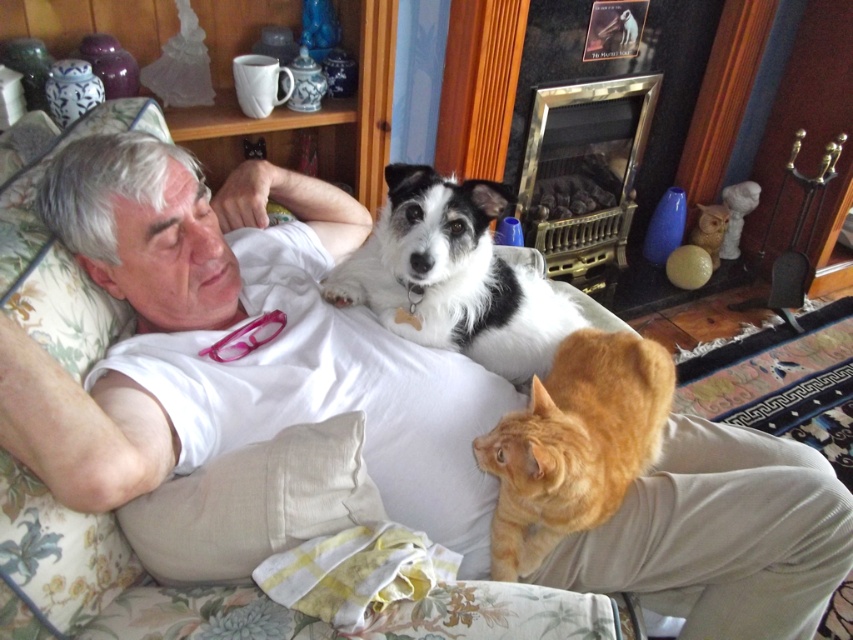
Question: Among these objects, which one is nearest to the camera?

Choices:
 (A) orange fur cat at lower right
 (B) gold brass fireplace at center
 (C) white fluffy dog at upper center

Answer: (A)

Question: Can you confirm if orange fur cat at lower right is positioned below gold brass fireplace at center?

Choices:
 (A) yes
 (B) no

Answer: (A)

Question: Where is orange fur cat at lower right located in relation to gold brass fireplace at center in the image?

Choices:
 (A) left
 (B) right

Answer: (A)

Question: Is white fluffy dog at upper center to the left of orange fur cat at lower right from the viewer's perspective?

Choices:
 (A) yes
 (B) no

Answer: (A)

Question: Which of the following is the closest to the observer?

Choices:
 (A) (608, 196)
 (B) (463, 260)

Answer: (B)

Question: Among these points, which one is nearest to the camera?

Choices:
 (A) (550, 272)
 (B) (606, 456)
 (C) (376, 307)

Answer: (B)